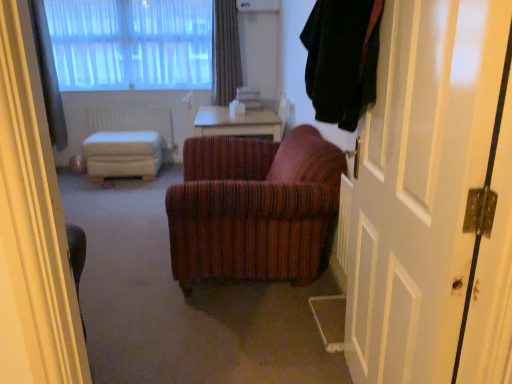
Question: Is white wooden door at right outside of white plastic radiator at center?

Choices:
 (A) no
 (B) yes

Answer: (B)

Question: From a real-world perspective, is white wooden door at right beneath white plastic radiator at center?

Choices:
 (A) no
 (B) yes

Answer: (A)

Question: Is white wooden door at right thinner than white plastic radiator at center?

Choices:
 (A) no
 (B) yes

Answer: (A)

Question: Considering the relative sizes of white wooden door at right and white plastic radiator at center in the image provided, is white wooden door at right wider than white plastic radiator at center?

Choices:
 (A) no
 (B) yes

Answer: (B)

Question: From the image's perspective, is white wooden door at right on white plastic radiator at center?

Choices:
 (A) no
 (B) yes

Answer: (A)

Question: Choose the correct answer: Is white sheer curtain at upper left, positioned as the 2th curtain in right-to-left order, inside white wooden door at right or outside it?

Choices:
 (A) outside
 (B) inside

Answer: (A)

Question: From a real-world perspective, is white sheer curtain at upper left, positioned as the 2th curtain in right-to-left order, positioned above or below white wooden door at right?

Choices:
 (A) below
 (B) above

Answer: (B)

Question: Looking at their shapes, would you say white sheer curtain at upper left, which is the 1th curtain in left-to-right order, is wider or thinner than white wooden door at right?

Choices:
 (A) wide
 (B) thin

Answer: (A)

Question: Is point (45, 28) closer or farther from the camera than point (455, 327)?

Choices:
 (A) closer
 (B) farther

Answer: (B)

Question: Visually, is white wooden door at right positioned to the left or to the right of white sheer curtains at upper left?

Choices:
 (A) right
 (B) left

Answer: (A)

Question: Based on their sizes in the image, would you say white wooden door at right is bigger or smaller than white sheer curtains at upper left?

Choices:
 (A) big
 (B) small

Answer: (B)

Question: From the image's perspective, is white wooden door at right located above or below white sheer curtains at upper left?

Choices:
 (A) above
 (B) below

Answer: (B)

Question: Is point (390, 64) closer or farther from the camera than point (173, 26)?

Choices:
 (A) closer
 (B) farther

Answer: (A)

Question: Is white plastic radiator at center situated inside white wooden door at right or outside?

Choices:
 (A) outside
 (B) inside

Answer: (A)

Question: Is point (100, 117) positioned closer to the camera than point (391, 238)?

Choices:
 (A) farther
 (B) closer

Answer: (A)